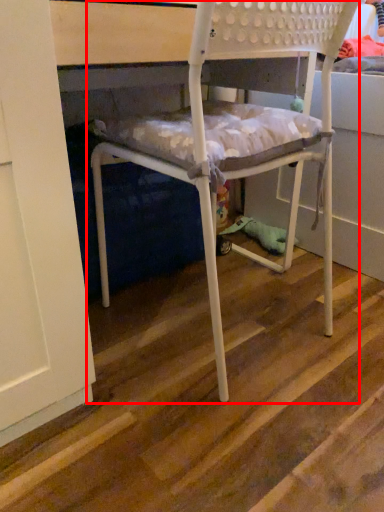
Question: From the image's perspective, where is chair (annotated by the red box) located relative to stair?

Choices:
 (A) below
 (B) above

Answer: (B)